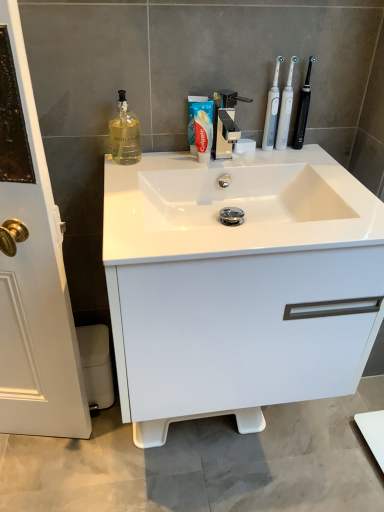
Question: Is white glossy sink at center wider or thinner than white glossy cabinet at center?

Choices:
 (A) thin
 (B) wide

Answer: (B)

Question: Is white glossy sink at center taller or shorter than white glossy cabinet at center?

Choices:
 (A) tall
 (B) short

Answer: (B)

Question: Which object is positioned farthest from the white plastic toothbrush at upper center, the first toothbrush in the left-to-right sequence?

Choices:
 (A) white glossy sink at center
 (B) translucent glass bottle at upper left
 (C) black plastic toothbrush at upper right, the third toothbrush in the left-to-right sequence
 (D) white matte toothpaste at center
 (E) white plastic toothbrush at upper right, the second toothbrush viewed from the left

Answer: (B)

Question: Based on their relative distances, which object is nearer to the white plastic toothbrush at upper center, which is the third toothbrush in right-to-left order?

Choices:
 (A) white glossy cabinet at center
 (B) black plastic toothbrush at upper right, positioned as the first toothbrush in right-to-left order
 (C) white matte toothpaste at center
 (D) white glossy sink at center
 (E) translucent glass bottle at upper left

Answer: (B)